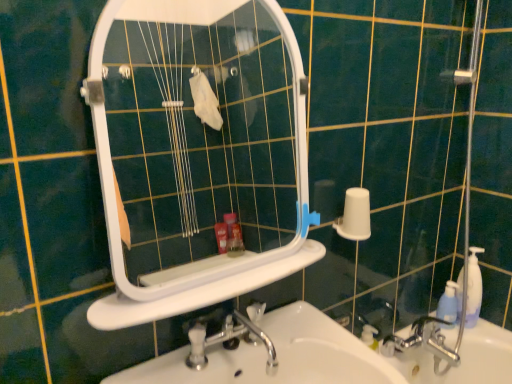
Identify the location of vacant area on top of white plastic ledge at center (from a real-world perspective). (216, 278).